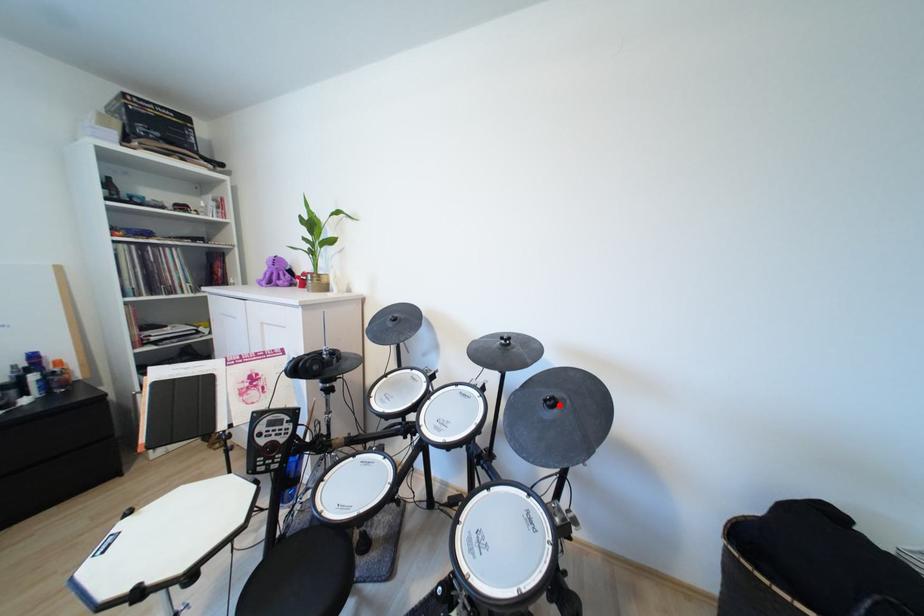
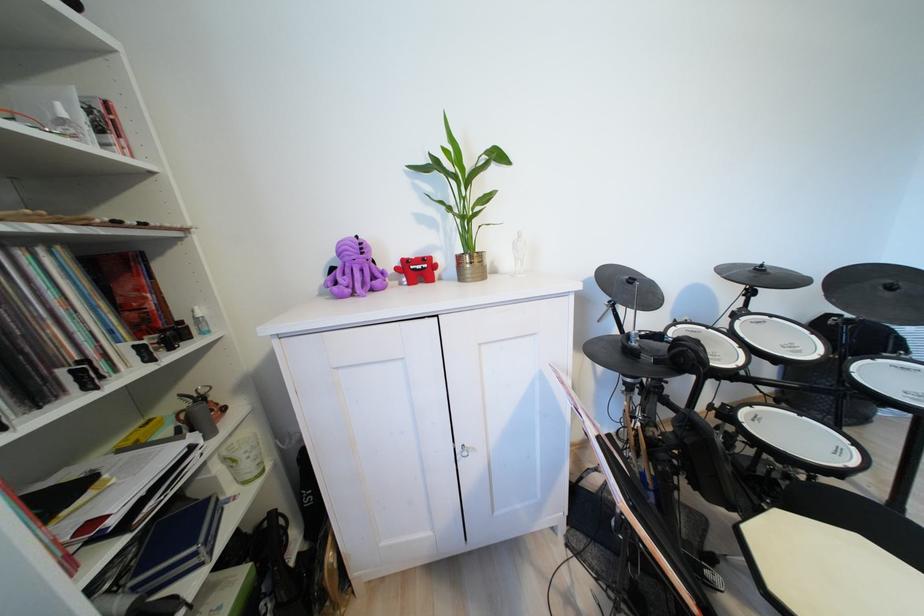
Question: I am providing you with two images of the same scene from different viewpoints. In image1, a red point is highlighted. Considering the same 3D point in image2, which of the following is correct?

Choices:
 (A) It is closer
 (B) It is farther

Answer: (A)